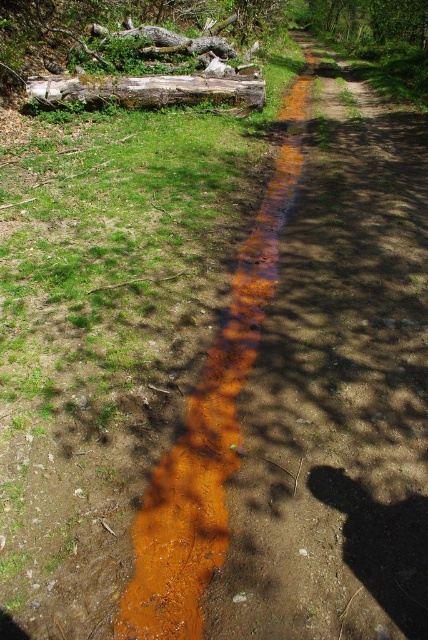
Consider the image. Measure the distance from brown mud at center to brown rough log at upper center.

brown mud at center is 5.14 meters away from brown rough log at upper center.

Is point (247, 250) behind point (211, 51)?

No, it is in front of (211, 51).

At what (x,y) coordinates should I click in order to perform the action: click on brown mud at center. Please return your answer as a coordinate pair (x, y). Looking at the image, I should click on (210, 428).

You are a GUI agent. You are given a task and a screenshot of the screen. Output one action in this format:
    pyautogui.click(x=<x>, y=<y>)
    Task: Click on the brown mud at center
    The height and width of the screenshot is (640, 428).
    Given the screenshot: What is the action you would take?
    pyautogui.click(x=210, y=428)

Does point (288, 147) lie behind point (225, 86)?

No.

From the picture: Can you confirm if brown mud at center is bigger than weathered wood log at upper left?

Indeed, brown mud at center has a larger size compared to weathered wood log at upper left.

This screenshot has width=428, height=640. Describe the element at coordinates (210, 428) in the screenshot. I see `brown mud at center` at that location.

In order to click on brown mud at center in this screenshot , I will do `click(210, 428)`.

Which is in front, point (55, 81) or point (112, 36)?

Point (55, 81)

Does weathered wood log at upper left appear on the left side of brown rough log at upper center?

In fact, weathered wood log at upper left is to the right of brown rough log at upper center.

What are the coordinates of `weathered wood log at upper left` in the screenshot? It's located at pos(148,90).

Find the location of `weathered wood log at upper left`. weathered wood log at upper left is located at coordinates (148, 90).